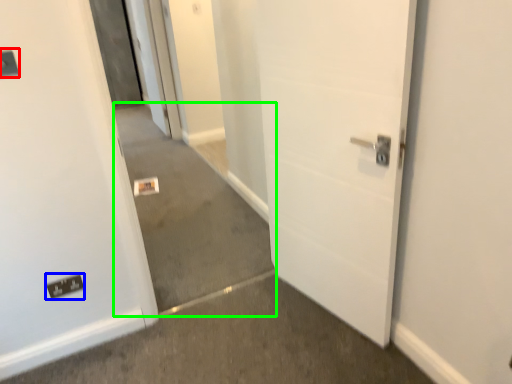
Question: Which object is the closest to the light switch (highlighted by a red box)? Choose among these: electric outlet (highlighted by a blue box) or concrete (highlighted by a green box).

Choices:
 (A) electric outlet
 (B) concrete

Answer: (A)